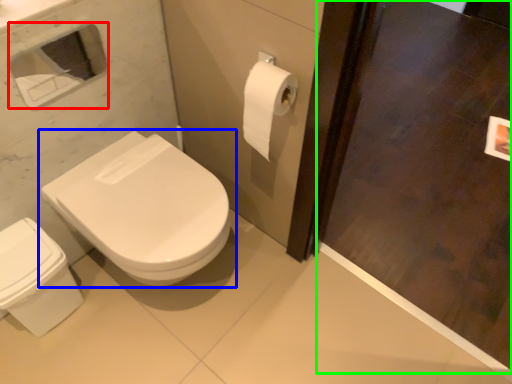
Question: Considering the real-world distances, which object is farthest from medicine cabinet (highlighted by a red box)? toilet (highlighted by a blue box) or screen door (highlighted by a green box)?

Choices:
 (A) toilet
 (B) screen door

Answer: (B)